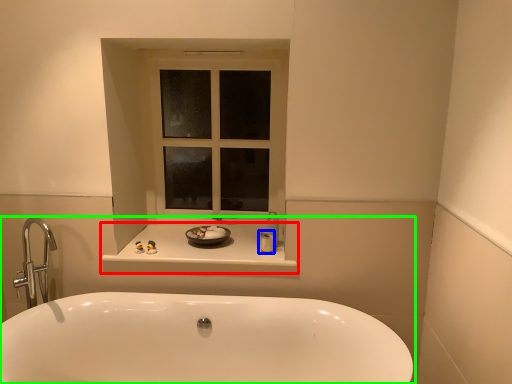
Question: Which object is positioned closest to counter top (highlighted by a red box)? Select from toiletry (highlighted by a blue box) and bathtub (highlighted by a green box).

Choices:
 (A) toiletry
 (B) bathtub

Answer: (A)